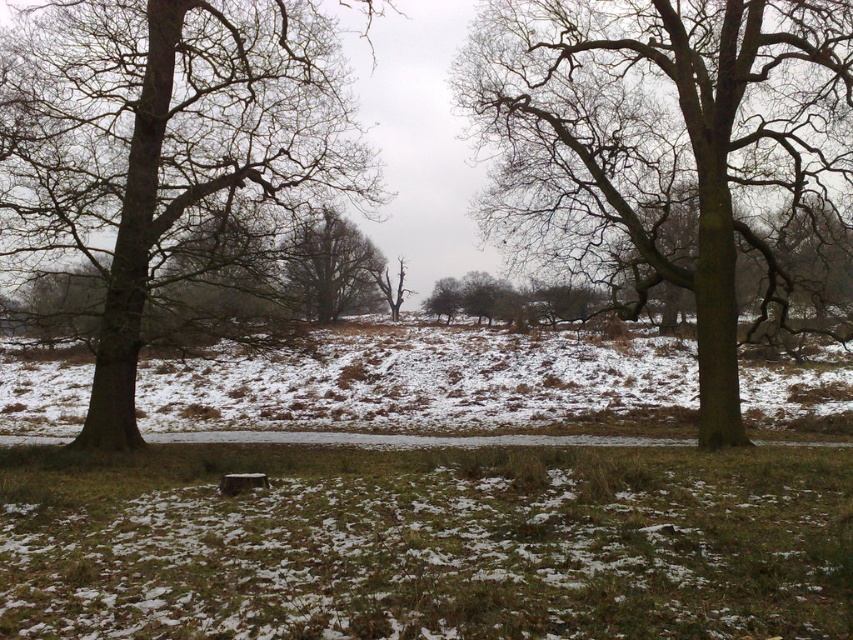
Is point (213, 598) closer to viewer compared to point (352, 284)?

Yes, it is in front of point (352, 284).

Does green grass at center have a lesser width compared to smooth bark tree at center?

Incorrect, green grass at center's width is not less than smooth bark tree at center's.

Between point (432, 458) and point (361, 308), which one is positioned behind?

The point (361, 308) is behind.

At what (x,y) coordinates should I click in order to perform the action: click on green grass at center. Please return your answer as a coordinate pair (x, y). The image size is (853, 640). Looking at the image, I should click on (426, 544).

Between point (83, 28) and point (329, 246), which one is positioned behind?

Positioned behind is point (329, 246).

Can you confirm if brown rough bark tree at left is positioned below smooth bark tree at center?

Actually, brown rough bark tree at left is above smooth bark tree at center.

Is point (144, 177) positioned behind point (361, 244)?

No, it is in front of (361, 244).

Where is `brown rough bark tree at left`? This screenshot has height=640, width=853. brown rough bark tree at left is located at coordinates (163, 145).

Where is `green rough bark tree at center`? green rough bark tree at center is located at coordinates (659, 138).

Is green rough bark tree at center further to camera compared to brown rough bark tree at left?

Yes, it is.

Image resolution: width=853 pixels, height=640 pixels. Find the location of `green rough bark tree at center`. green rough bark tree at center is located at coordinates (659, 138).